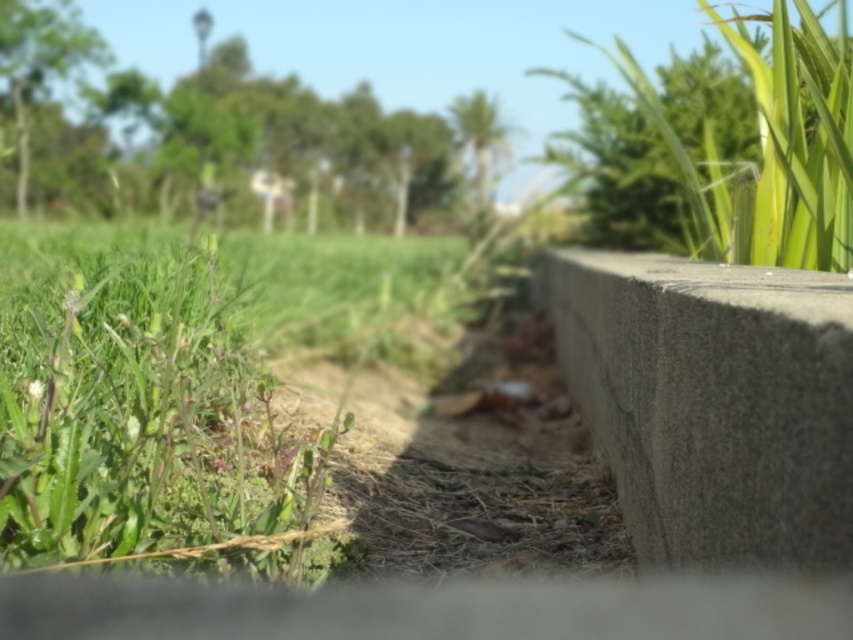
You are a gardener who needs to water the green grass at left and the gray concrete at right. Your water hose can reach 3 meters. Can you water both areas without moving the hose? Please explain your answer.

The distance between the green grass at left and gray concrete at right is 3.66 meters. Since the hose can only reach 3 meters, you cannot water both areas without moving the hose because the distance exceeds the hose length.